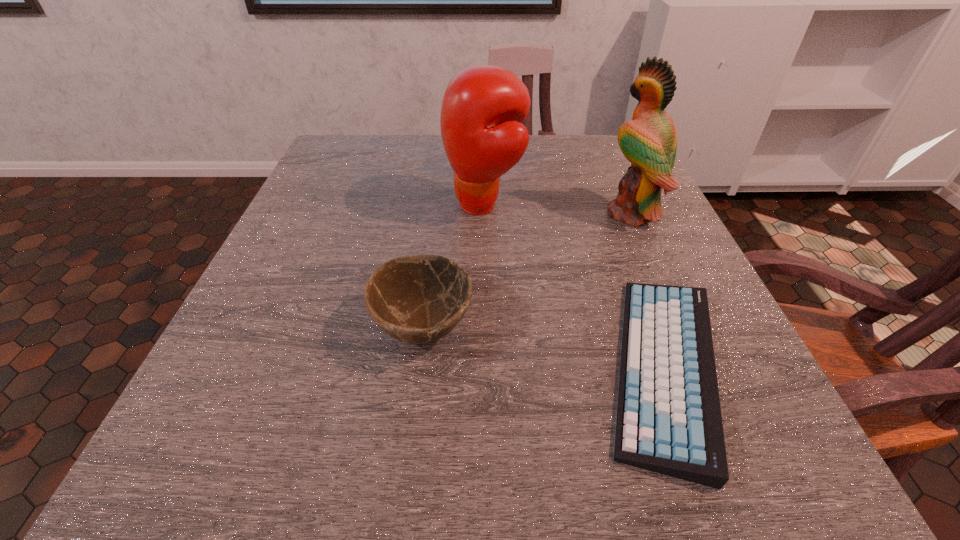
Locate an element on the screen. The height and width of the screenshot is (540, 960). vacant space that satisfies the following two spatial constraints: 1. on the striking surface of the computer keyboard; 2. on the right side of the boxing glove is located at coordinates (486, 368).

The height and width of the screenshot is (540, 960). What are the coordinates of `vacant space that satisfies the following two spatial constraints: 1. on the striking surface of the boxing glove; 2. on the back side of the shortest object` in the screenshot? It's located at (486, 368).

At what (x,y) coordinates should I click in order to perform the action: click on free space that satisfies the following two spatial constraints: 1. on the back side of the shortest object; 2. on the striking surface of the boxing glove. Please return your answer as a coordinate pair (x, y). Image resolution: width=960 pixels, height=540 pixels. Looking at the image, I should click on (604, 205).

This screenshot has width=960, height=540. Identify the location of vacant space that satisfies the following two spatial constraints: 1. on the striking surface of the boxing glove; 2. on the back side of the shortest object. (486, 368).

This screenshot has width=960, height=540. In order to click on vacant space that satisfies the following two spatial constraints: 1. on the striking surface of the computer keyboard; 2. on the left side of the boxing glove in this screenshot , I will do `click(486, 368)`.